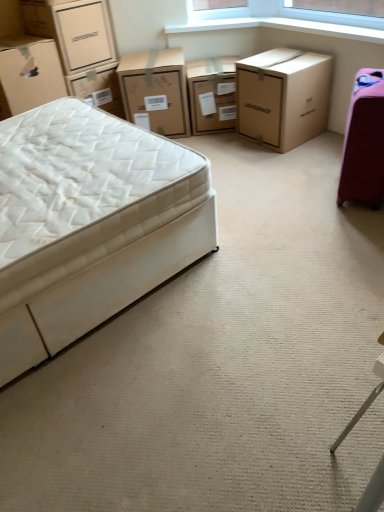
At what (x,y) coordinates should I click in order to perform the action: click on vacant area that is situated to the right of white fabric bed at left. Please return your answer as a coordinate pair (x, y). This screenshot has height=512, width=384. Looking at the image, I should click on (270, 270).